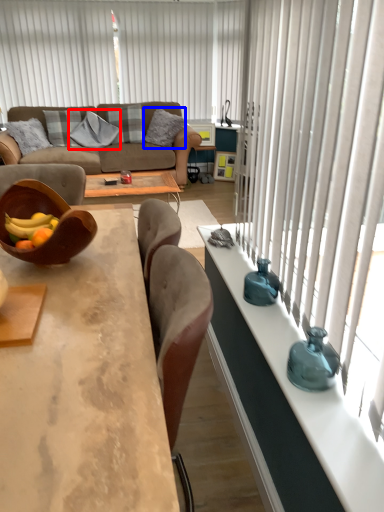
Question: Which object appears farthest to the camera in this image, pillow (highlighted by a red box) or pillow (highlighted by a blue box)?

Choices:
 (A) pillow
 (B) pillow

Answer: (A)